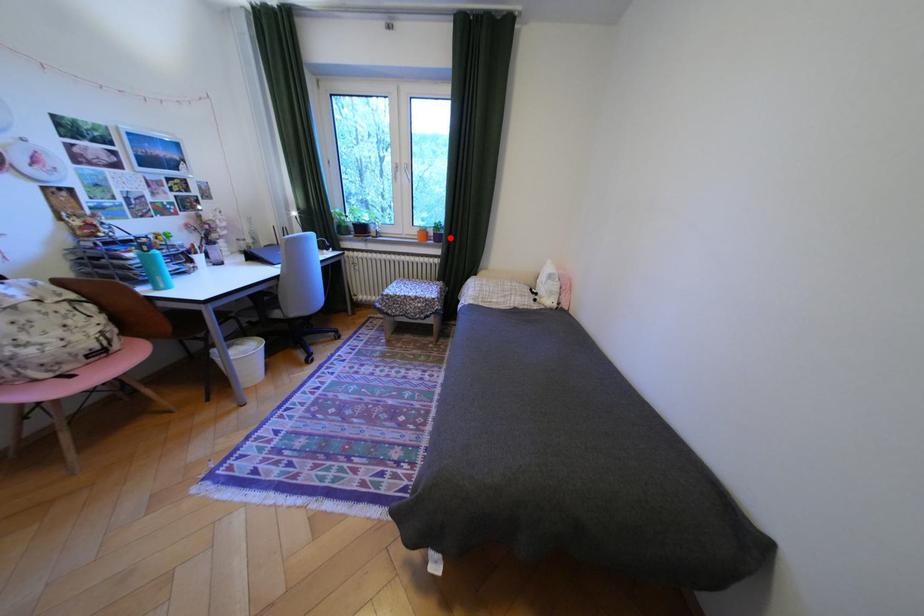
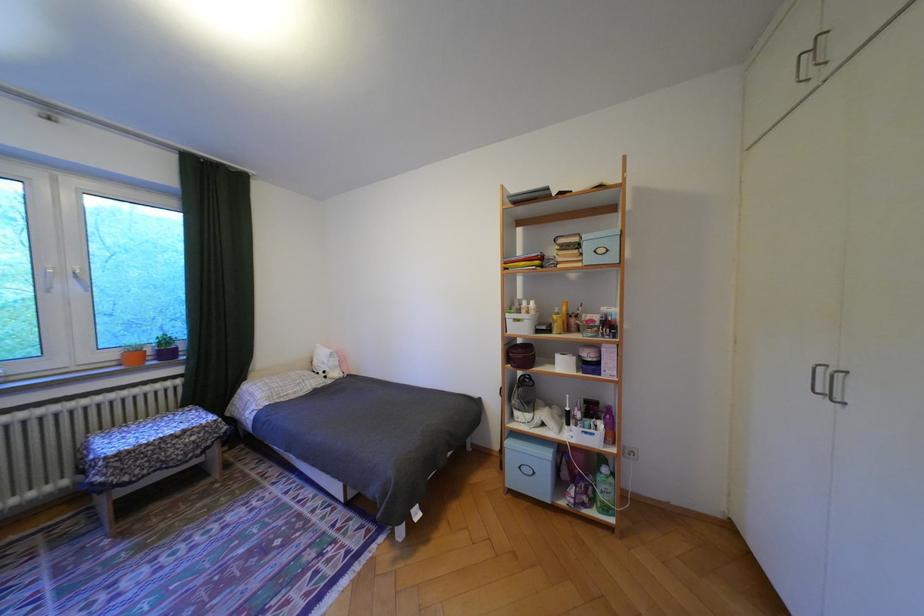
Find the pixel in the second image that matches the highlighted location in the first image.

(178, 354)